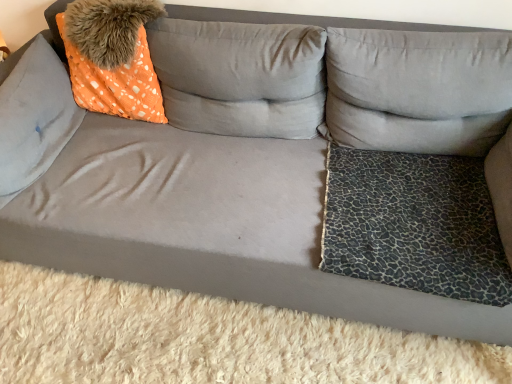
Question: Should I look upward or downward to see leopard print fabric pillow at right, which is the third pillow from left to right?

Choices:
 (A) up
 (B) down

Answer: (A)

Question: Is suede orange pillow at left, acting as the 1th pillow starting from the left, taller than leopard print fabric pillow at right, the 1th pillow when ordered from right to left?

Choices:
 (A) yes
 (B) no

Answer: (B)

Question: Can you confirm if suede orange pillow at left, acting as the 1th pillow starting from the left, is shorter than leopard print fabric pillow at right, which is the third pillow from left to right?

Choices:
 (A) no
 (B) yes

Answer: (B)

Question: Can you confirm if suede orange pillow at left, the third pillow positioned from the right, is positioned to the left of leopard print fabric pillow at right, the 1th pillow when ordered from right to left?

Choices:
 (A) no
 (B) yes

Answer: (B)

Question: Would you say suede orange pillow at left, the third pillow positioned from the right, is outside leopard print fabric pillow at right, which is the third pillow from left to right?

Choices:
 (A) no
 (B) yes

Answer: (B)

Question: From a real-world perspective, is suede orange pillow at left, the third pillow positioned from the right, located higher than leopard print fabric pillow at right, the 1th pillow when ordered from right to left?

Choices:
 (A) yes
 (B) no

Answer: (B)

Question: Is suede orange pillow at left, the third pillow positioned from the right, closer to camera compared to leopard print fabric pillow at right, which is the third pillow from left to right?

Choices:
 (A) yes
 (B) no

Answer: (A)

Question: Is orange dotted fabric at upper left at the left side of leopard print fabric pillow at right, which is the third pillow from left to right?

Choices:
 (A) yes
 (B) no

Answer: (A)

Question: Considering the relative sizes of orange dotted fabric at upper left and leopard print fabric pillow at right, the 1th pillow when ordered from right to left, in the image provided, is orange dotted fabric at upper left bigger than leopard print fabric pillow at right, the 1th pillow when ordered from right to left,?

Choices:
 (A) no
 (B) yes

Answer: (A)

Question: Considering the relative positions of orange dotted fabric at upper left and leopard print fabric pillow at right, the 1th pillow when ordered from right to left, in the image provided, is orange dotted fabric at upper left to the right of leopard print fabric pillow at right, the 1th pillow when ordered from right to left, from the viewer's perspective?

Choices:
 (A) yes
 (B) no

Answer: (B)

Question: From a real-world perspective, is orange dotted fabric at upper left under leopard print fabric pillow at right, the 1th pillow when ordered from right to left?

Choices:
 (A) no
 (B) yes

Answer: (A)

Question: Is orange dotted fabric at upper left directly adjacent to leopard print fabric pillow at right, which is the third pillow from left to right?

Choices:
 (A) yes
 (B) no

Answer: (B)

Question: From the image's perspective, is orange dotted fabric at upper left under leopard print fabric pillow at right, which is the third pillow from left to right?

Choices:
 (A) no
 (B) yes

Answer: (A)

Question: Would you say suede orange pillow at left, the third pillow positioned from the right, is outside orange dotted fabric pillow at upper left, which is the 2th pillow in right-to-left order?

Choices:
 (A) yes
 (B) no

Answer: (A)